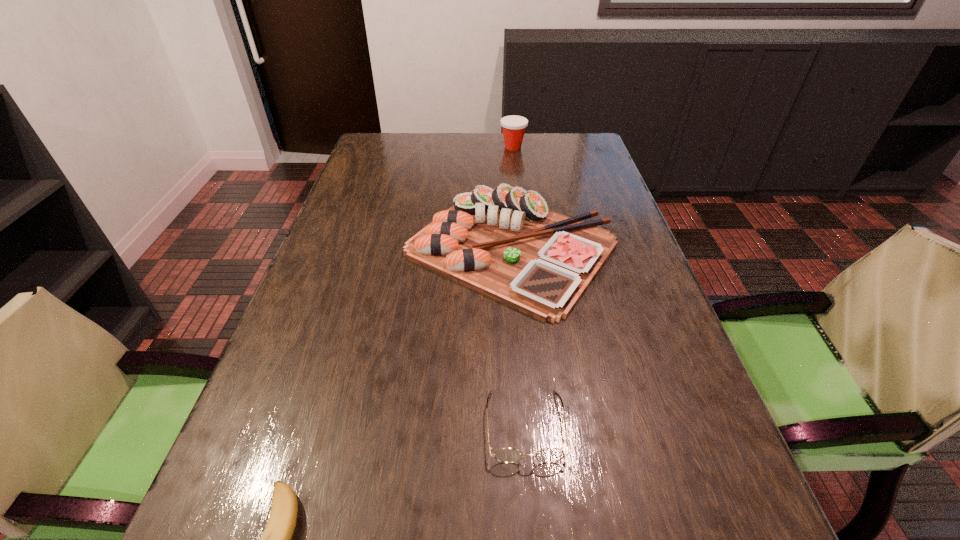
Locate an element on the screen. The image size is (960, 540). the farthest object is located at coordinates (513, 126).

Identify the location of the second farthest object. (505, 243).

At what (x,y) coordinates should I click in order to perform the action: click on the third shortest object. Please return your answer as a coordinate pair (x, y). The image size is (960, 540). Looking at the image, I should click on (505, 243).

Find the location of a particular element. The width and height of the screenshot is (960, 540). the third farthest object is located at coordinates (505, 455).

Where is `free space located on the front of the Dixie cup`? free space located on the front of the Dixie cup is located at coordinates (515, 161).

Locate an element on the screen. Image resolution: width=960 pixels, height=540 pixels. blank space located 0.360m on the front of the second tallest object is located at coordinates (533, 501).

Find the location of a particular element. The image size is (960, 540). vacant space situated 0.080m on the lenses of the spectacles is located at coordinates (533, 519).

This screenshot has width=960, height=540. What are the coordinates of `object positioned at the far edge` in the screenshot? It's located at (513, 126).

At what (x,y) coordinates should I click in order to perform the action: click on object positioned at the right edge. Please return your answer as a coordinate pair (x, y). The width and height of the screenshot is (960, 540). Looking at the image, I should click on (505, 243).

Find the location of a particular element. free space at the far edge of the desktop is located at coordinates (486, 146).